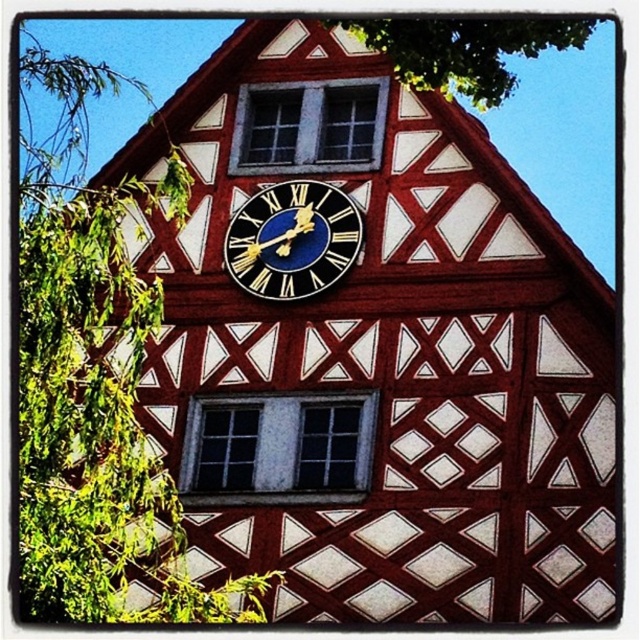
You are standing in front of the traditional half timbered building and want to take a photo of the large clock between the two windows. The green leafy tree at left is blocking your view. Can you move to the right or left to avoid the tree?

Since the green leafy tree at left is located at point (93, 380), moving to the right would allow you to avoid the tree and get an unobstructed view of the clock between the two windows.

You are standing in front of the traditional half timbered building. You see the green leafy tree at left and the green leafy tree at upper center. Which tree is closer to you?

The green leafy tree at left is closer to you because it is in front of the green leafy tree at upper center.

You are standing in front of a traditional half timbered building with two windows and a clock. You notice two points marked on the building. One is at coordinate point (92, 531) and the other at point (461, 86). Which point is closer to you?

Point (92, 531) is closer to you than point (461, 86).